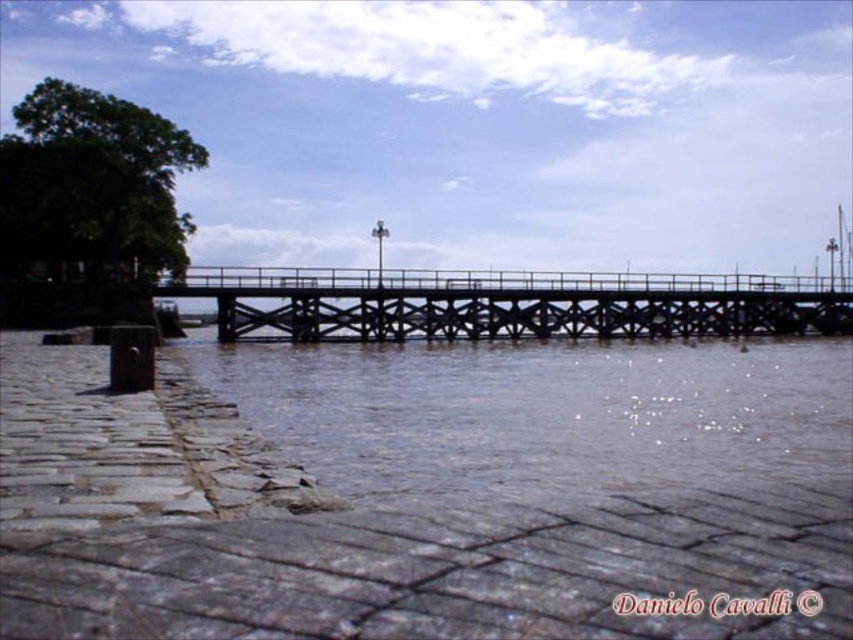
Can you confirm if brown/muddy water at center is positioned to the left of black metal bridge at center?

Yes, brown/muddy water at center is to the left of black metal bridge at center.

Is brown/muddy water at center to the right of black metal bridge at center from the viewer's perspective?

In fact, brown/muddy water at center is to the left of black metal bridge at center.

What are the coordinates of `brown/muddy water at center` in the screenshot? It's located at click(x=538, y=412).